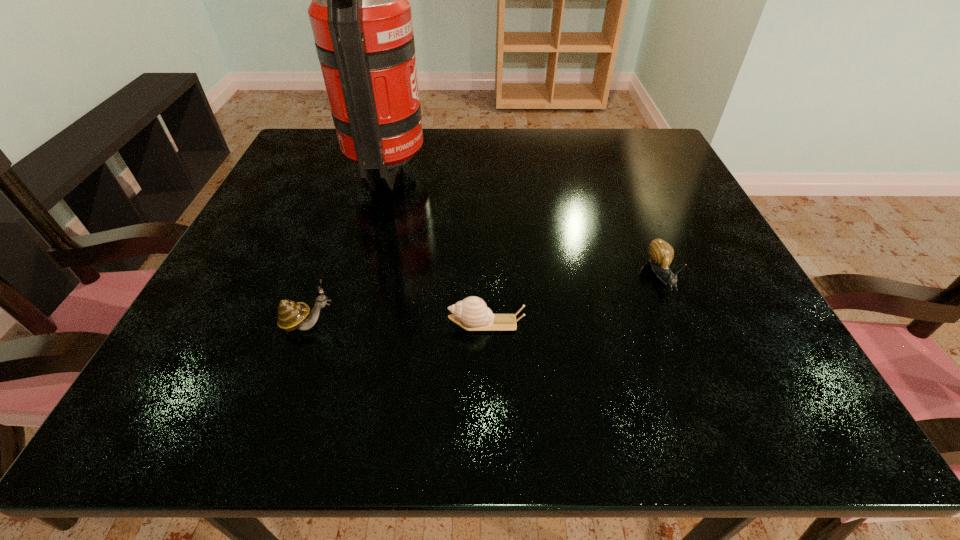
This screenshot has width=960, height=540. In order to click on free space that is in between the fire extinguisher and the third nearest object in this screenshot , I will do `click(525, 221)`.

The width and height of the screenshot is (960, 540). Identify the location of vacant area that lies between the second escargot from right to left and the leftmost escargot. tap(397, 324).

Image resolution: width=960 pixels, height=540 pixels. I want to click on empty location between the farthest escargot and the tallest escargot, so click(485, 300).

This screenshot has height=540, width=960. Identify the location of free space between the rightmost object and the farthest object. (525, 221).

In order to click on free space between the second object from right to left and the farthest escargot in this screenshot , I will do `click(574, 300)`.

Locate an element on the screen. object that can be found as the second closest to the second escargot from left to right is located at coordinates (661, 253).

I want to click on the third closest object to the leftmost escargot, so click(x=661, y=253).

Select which escargot is the closest to the third shortest object. Please provide its 2D coordinates. Your answer should be formatted as a tuple, i.e. [(x, y)], where the tuple contains the x and y coordinates of a point satisfying the conditions above.

[(472, 314)]

This screenshot has height=540, width=960. Find the location of `escargot that is the second closest to the second farthest object`. escargot that is the second closest to the second farthest object is located at coordinates click(291, 315).

This screenshot has height=540, width=960. I want to click on vacant space that satisfies the following two spatial constraints: 1. on the front-facing side of the rightmost escargot; 2. on the shell of the second escargot from left to right, so click(x=682, y=323).